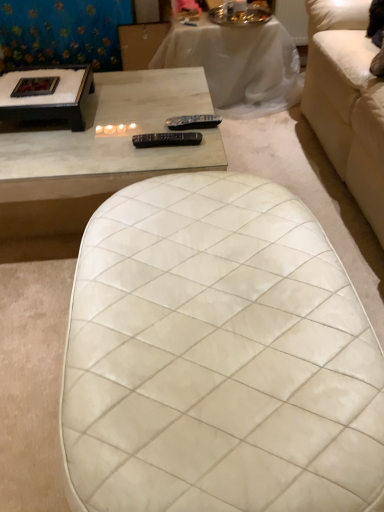
At what (x,y) coordinates should I click in order to perform the action: click on free point to the left of black plastic remote at center, the 2th remote in the front-to-back sequence. Please return your answer as a coordinate pair (x, y). Looking at the image, I should click on (141, 136).